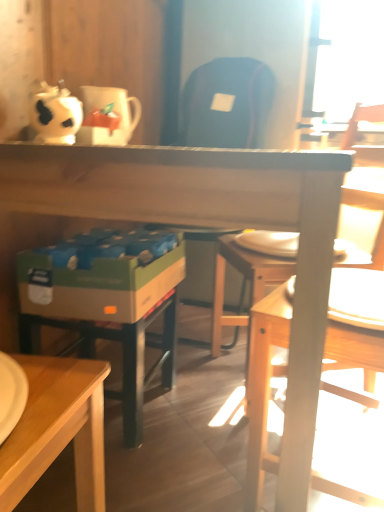
Question: Is wooden chair at right at the right side of white glossy coffee cup at upper left?

Choices:
 (A) no
 (B) yes

Answer: (B)

Question: Is wooden chair at right oriented away from white glossy coffee cup at upper left?

Choices:
 (A) yes
 (B) no

Answer: (B)

Question: Considering the relative sizes of wooden chair at right and white glossy coffee cup at upper left in the image provided, is wooden chair at right bigger than white glossy coffee cup at upper left?

Choices:
 (A) yes
 (B) no

Answer: (A)

Question: Is wooden chair at right closer to camera compared to white glossy coffee cup at upper left?

Choices:
 (A) no
 (B) yes

Answer: (B)

Question: From a real-world perspective, is wooden chair at right located higher than white glossy coffee cup at upper left?

Choices:
 (A) yes
 (B) no

Answer: (B)

Question: Is wooden chair at right not within white glossy coffee cup at upper left?

Choices:
 (A) no
 (B) yes

Answer: (B)

Question: Is wooden desk at center with white glossy coffee cup at upper left?

Choices:
 (A) no
 (B) yes

Answer: (A)

Question: From the image's perspective, does wooden desk at center appear lower than white glossy coffee cup at upper left?

Choices:
 (A) no
 (B) yes

Answer: (B)

Question: Is wooden desk at center completely or partially outside of white glossy coffee cup at upper left?

Choices:
 (A) yes
 (B) no

Answer: (A)

Question: Considering the relative sizes of wooden desk at center and white glossy coffee cup at upper left in the image provided, is wooden desk at center shorter than white glossy coffee cup at upper left?

Choices:
 (A) no
 (B) yes

Answer: (A)

Question: Considering the relative sizes of wooden desk at center and white glossy coffee cup at upper left in the image provided, is wooden desk at center thinner than white glossy coffee cup at upper left?

Choices:
 (A) yes
 (B) no

Answer: (B)

Question: Considering the relative positions of wooden desk at center and white glossy coffee cup at upper left in the image provided, is wooden desk at center to the left of white glossy coffee cup at upper left from the viewer's perspective?

Choices:
 (A) yes
 (B) no

Answer: (B)

Question: Can you confirm if white glossy coffee cup at upper left is taller than wooden desk at center?

Choices:
 (A) yes
 (B) no

Answer: (B)